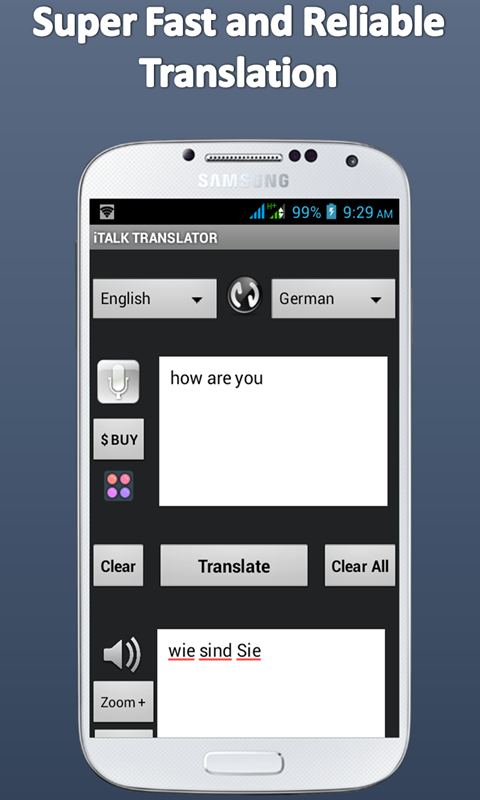
Locate an element on the screen. The width and height of the screenshot is (480, 800). rounded corners is located at coordinates (112, 776), (393, 780), (108, 156), (398, 161).